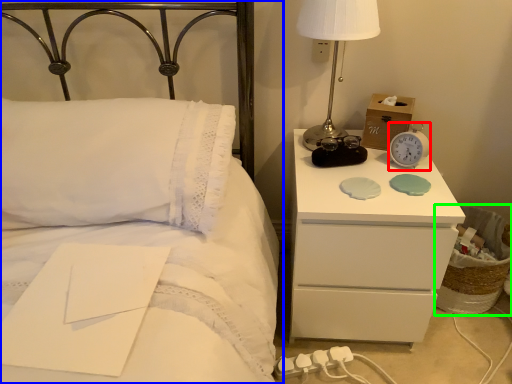
Question: Considering the real-world distances, which object is closest to alarm clock (highlighted by a red box)? bed (highlighted by a blue box) or basket (highlighted by a green box).

Choices:
 (A) bed
 (B) basket

Answer: (B)